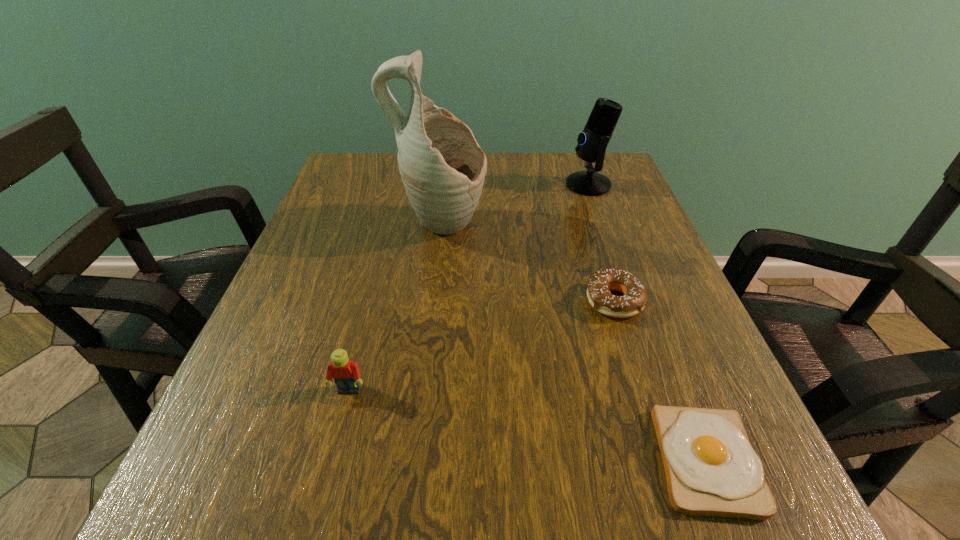
Identify which object is the second nearest to the farthest object. Please provide its 2D coordinates. Your answer should be formatted as a tuple, i.e. [(x, y)], where the tuple contains the x and y coordinates of a point satisfying the conditions above.

[(600, 283)]

Identify the location of object that is the third closest to the microphone. (711, 469).

At what (x,y) coordinates should I click in order to perform the action: click on free space that satisfies the following two spatial constraints: 1. at the spout of the pitcher; 2. on the back side of the third farthest object. Please return your answer as a coordinate pair (x, y). Looking at the image, I should click on (432, 301).

At what (x,y) coordinates should I click in order to perform the action: click on free location that satisfies the following two spatial constraints: 1. at the spout of the fourth nearest object; 2. on the back side of the toast. Please return your answer as a coordinate pair (x, y). The height and width of the screenshot is (540, 960). Looking at the image, I should click on (414, 461).

Find the location of a particular element. The image size is (960, 540). vacant space that satisfies the following two spatial constraints: 1. on the face of the toast; 2. on the right side of the third tallest object is located at coordinates (331, 461).

Find the location of a particular element. The width and height of the screenshot is (960, 540). free location that satisfies the following two spatial constraints: 1. at the spout of the tallest object; 2. on the face of the second nearest object is located at coordinates (422, 390).

I want to click on vacant space that satisfies the following two spatial constraints: 1. at the spout of the pitcher; 2. on the left side of the toast, so pyautogui.click(x=414, y=461).

Locate an element on the screen. free space that satisfies the following two spatial constraints: 1. at the spout of the shortest object; 2. on the left side of the fourth nearest object is located at coordinates (414, 461).

Image resolution: width=960 pixels, height=540 pixels. I want to click on free location that satisfies the following two spatial constraints: 1. on the stand of the second tallest object; 2. on the face of the third tallest object, so click(661, 390).

You are a GUI agent. You are given a task and a screenshot of the screen. Output one action in this format:
    pyautogui.click(x=<x>, y=<y>)
    Task: Click on the free location that satisfies the following two spatial constraints: 1. at the spout of the tallest object; 2. on the left side of the doughnut
    Image resolution: width=960 pixels, height=540 pixels.
    Given the screenshot: What is the action you would take?
    (432, 301)